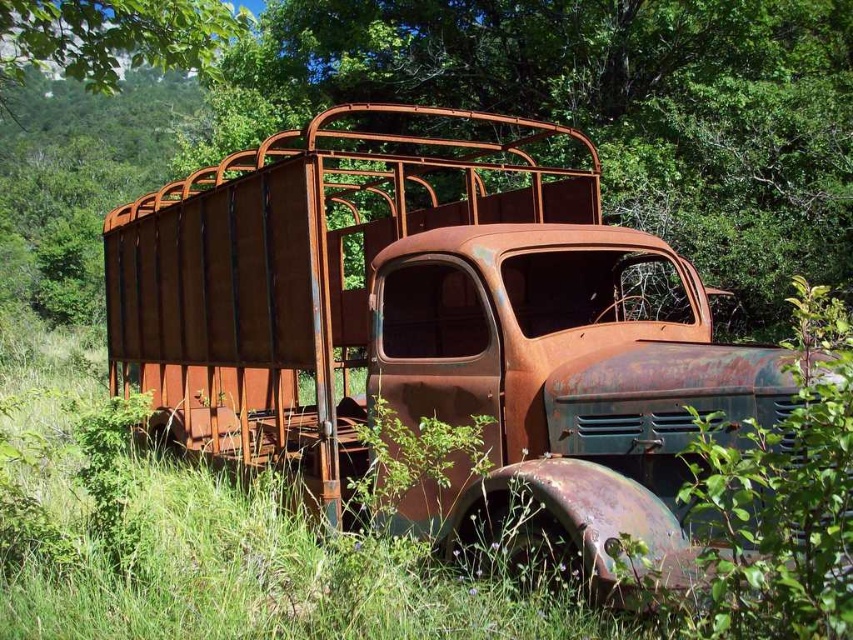
You are a delivery driver who needs to park your truck in a small parking spot that can only accommodate vehicles occupying the same amount of space as the rusty metal trailer truck at center. Can you park your truck in the spot if you have the rusty metal truck at center?

The rusty metal trailer truck at center occupies less space than the rusty metal truck at center. Therefore, the parking spot can only accommodate the smaller vehicle. Since your truck, the rusty metal truck at center, is larger, it cannot fit into the parking spot designed for the size of the rusty metal trailer truck at center.

You are a photographer wanting to capture the rusty metal trailer truck at center and the rusty metal truck at center in a single frame. Based on their positions, which one should you focus on first to ensure both are in the shot?

The rusty metal trailer truck at center is located below the rusty metal truck at center, so focusing on the higher positioned rusty metal truck at center first will allow you to frame both objects within the shot.

You are a photographer standing in front of the rusty metal trailer truck at center and the rusty metal truck at center. You want to take a clear photo of both vehicles. Which one should you focus on first to ensure it is sharp in the image?

You should focus on the rusty metal trailer truck at center first because it is closer to you than the rusty metal truck at center, so focusing on it will ensure it remains sharp while the other may appear slightly blurred due to depth of field limitations.